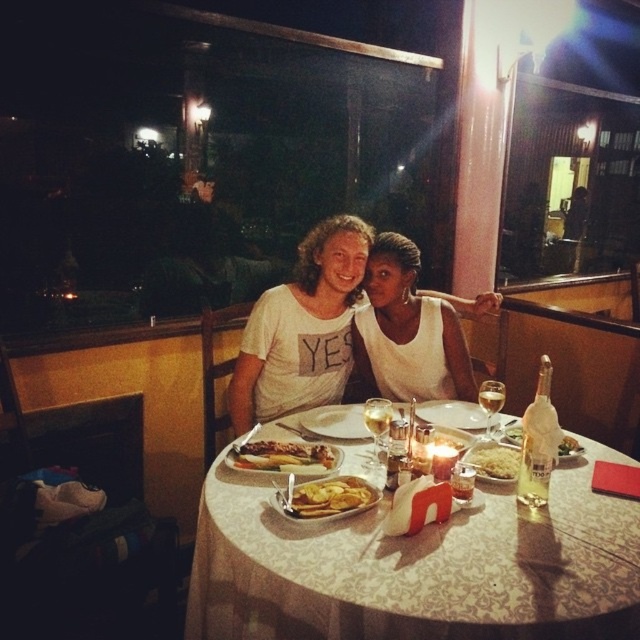
Question: Which is nearer to the matte glass plate at center?

Choices:
 (A) white lace tablecloth at center
 (B) golden crispy chicken at center
 (C) white cotton shirt at center
 (D) white rice at table center

Answer: (B)

Question: Is the position of white lace tablecloth at center less distant than that of translucent glass bottle at right?

Choices:
 (A) no
 (B) yes

Answer: (B)

Question: Which object appears farthest from the camera in this image?

Choices:
 (A) white lace tablecloth at center
 (B) white matte tank top at center
 (C) white cotton shirt at center

Answer: (B)

Question: Considering the relative positions of white cotton shirt at center and white rice at table center in the image provided, where is white cotton shirt at center located with respect to white rice at table center?

Choices:
 (A) right
 (B) left

Answer: (B)

Question: Is golden crispy chicken at center wider than yellow crispy chips at center?

Choices:
 (A) no
 (B) yes

Answer: (B)

Question: Estimate the real-world distances between objects in this image. Which object is farther from the matte glass plate at center?

Choices:
 (A) golden crispy chicken at center
 (B) white rice at table center
 (C) white matte tank top at center
 (D) translucent glass bottle at right

Answer: (C)